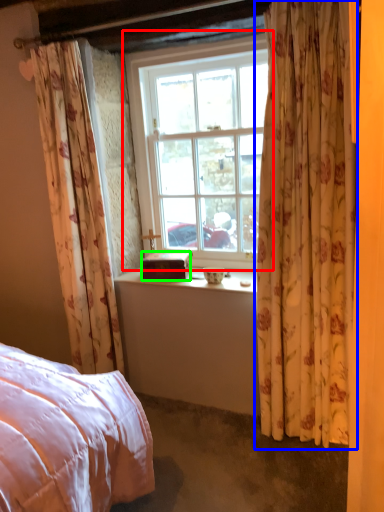
Question: Which is farther away from window (highlighted by a red box)? curtain (highlighted by a blue box) or box (highlighted by a green box)?

Choices:
 (A) curtain
 (B) box

Answer: (A)